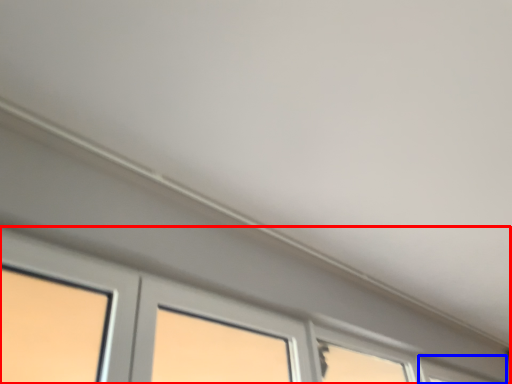
Question: Which of the following is the farthest to the observer, window (highlighted by a red box) or window (highlighted by a blue box)?

Choices:
 (A) window
 (B) window

Answer: (B)